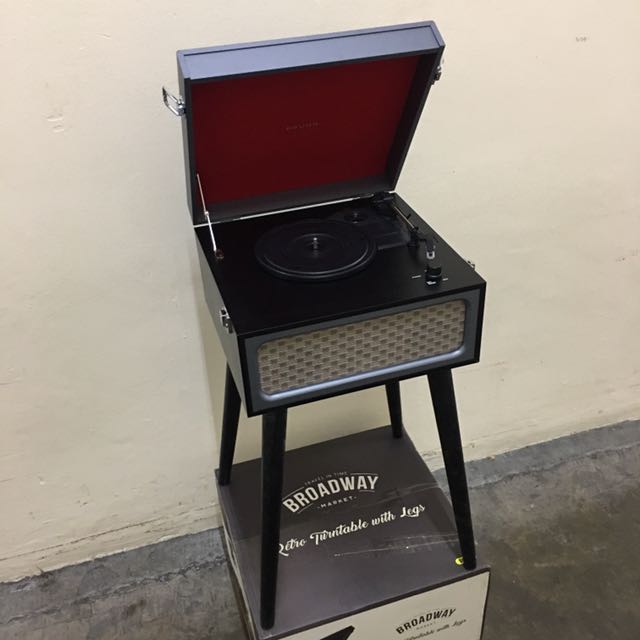
Image resolution: width=640 pixels, height=640 pixels. What are the coordinates of `lock` in the screenshot? It's located at (223, 316), (470, 264), (175, 93), (441, 68).